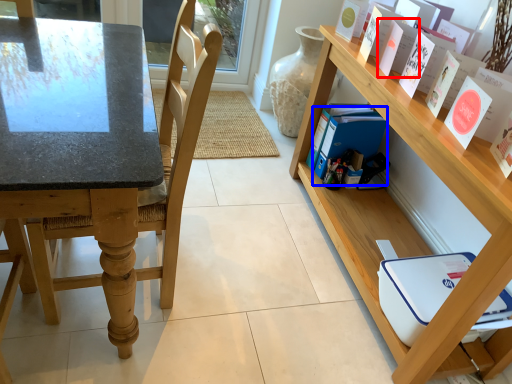
Question: Among these objects, which one is nearest to the camera, paperback book (highlighted by a red box) or paperback book (highlighted by a blue box)?

Choices:
 (A) paperback book
 (B) paperback book

Answer: (A)